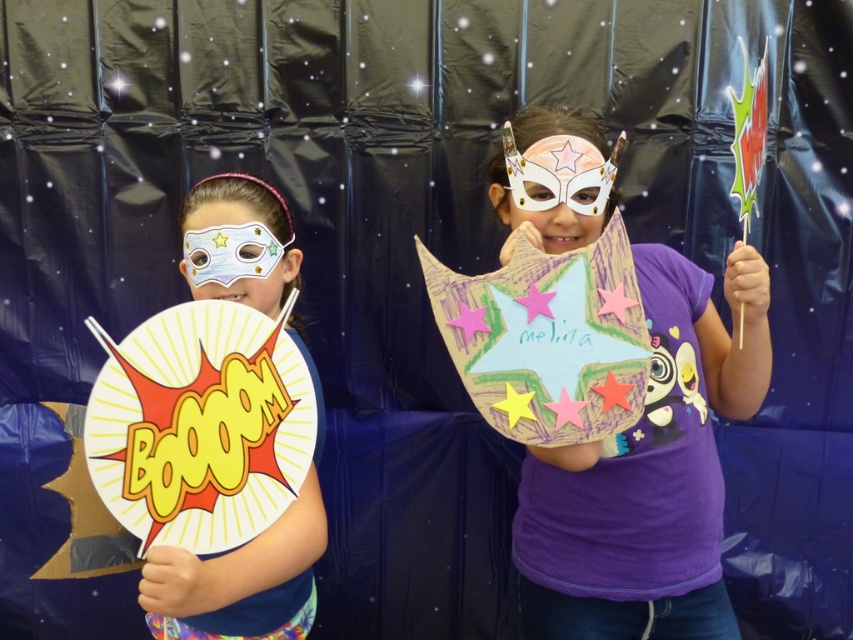
Question: Can you confirm if matte paper mask at left is thinner than white paper mask at center?

Choices:
 (A) yes
 (B) no

Answer: (B)

Question: Considering the real-world distances, which object is closest to the matte paper mask at left?

Choices:
 (A) pink paper star at center
 (B) matte white mask at left

Answer: (B)

Question: Which object is the farthest from the yellow paper star at center?

Choices:
 (A) yellow paper plate at left
 (B) purple paper star at center

Answer: (B)

Question: Considering the real-world distances, which object is closest to the yellow paper star at center?

Choices:
 (A) matte paper mask at left
 (B) white paper mask at center
 (C) purple paper star at center

Answer: (B)

Question: Can you confirm if purple paper star at center is smaller than yellow paper plate at left?

Choices:
 (A) no
 (B) yes

Answer: (A)

Question: Is yellow paper plate at left positioned at the back of matte paper mask at left?

Choices:
 (A) yes
 (B) no

Answer: (A)